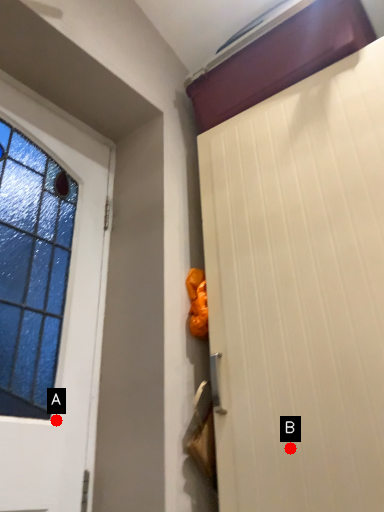
Question: Two points are circled on the image, labeled by A and B beside each circle. Which of the following is the farthest from the observer?

Choices:
 (A) A is further
 (B) B is further

Answer: (A)